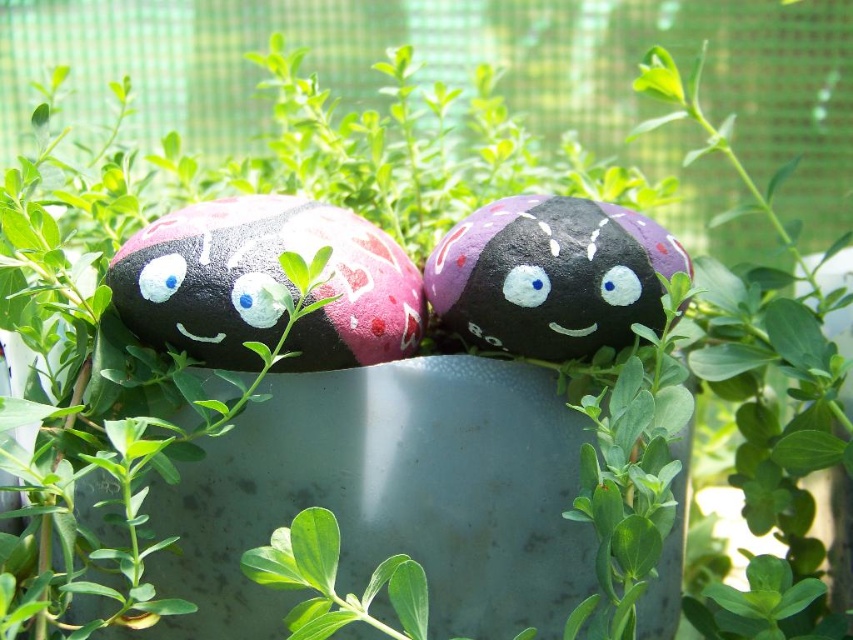
Question: Which point appears closest to the camera in this image?

Choices:
 (A) (271, 301)
 (B) (509, 284)

Answer: (A)

Question: Which of the following is the closest to the observer?

Choices:
 (A) (727, 400)
 (B) (518, 280)
 (C) (604, 284)
 (D) (659, 230)

Answer: (B)

Question: From the image, what is the correct spatial relationship of purple matte rock at center in relation to blue matte eye at center?

Choices:
 (A) above
 (B) below

Answer: (A)

Question: Can you confirm if matte pink rock at center is positioned above purple matte rock at center?

Choices:
 (A) no
 (B) yes

Answer: (A)

Question: Which object is positioned closest to the white matte eye at center?

Choices:
 (A) green leafy plant at center
 (B) purple matte rock at center
 (C) matte pink rock at center

Answer: (B)

Question: Does matte pink rock at center appear on the left side of matte white eye at center?

Choices:
 (A) yes
 (B) no

Answer: (A)